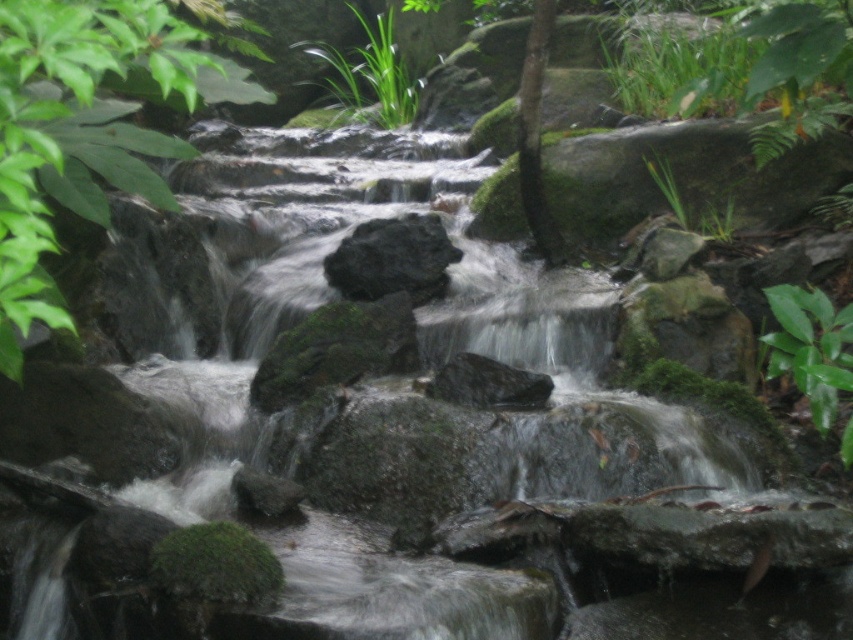
Is green matte leaf at upper right to the right of green leafy plant at upper center from the viewer's perspective?

Yes, green matte leaf at upper right is to the right of green leafy plant at upper center.

Who is higher up, green matte leaf at upper right or green leafy plant at upper center?

Positioned higher is green leafy plant at upper center.

Who is more distant from viewer, (782, 346) or (390, 45)?

The point (390, 45) is more distant.

Identify the location of green matte leaf at upper right. (810, 348).

Is the position of green leafy plant at upper left more distant than that of green leafy plant at upper center?

No, it is not.

Is point (28, 156) less distant than point (389, 36)?

Yes, point (28, 156) is closer to viewer.

The image size is (853, 640). Identify the location of green leafy plant at upper left. (78, 131).

Can you confirm if green leafy plant at upper left is bigger than green matte leaf at upper right?

Correct, green leafy plant at upper left is larger in size than green matte leaf at upper right.

Is green leafy plant at upper left further to the viewer compared to green matte leaf at upper right?

That is False.

This screenshot has width=853, height=640. Identify the location of green leafy plant at upper left. (78, 131).